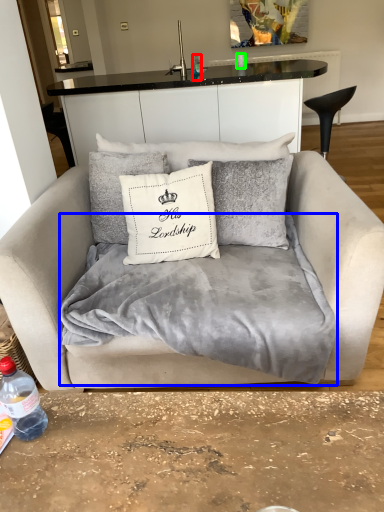
Question: Estimate the real-world distances between objects in this image. Which object is farther from bottle (highlighted by a red box), blanket (highlighted by a blue box) or coffee cup (highlighted by a green box)?

Choices:
 (A) blanket
 (B) coffee cup

Answer: (A)